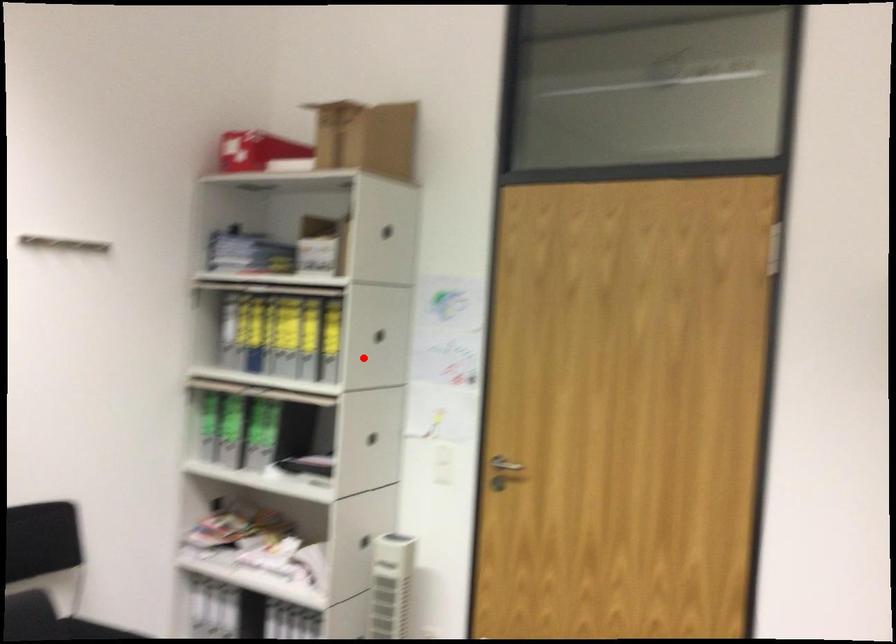
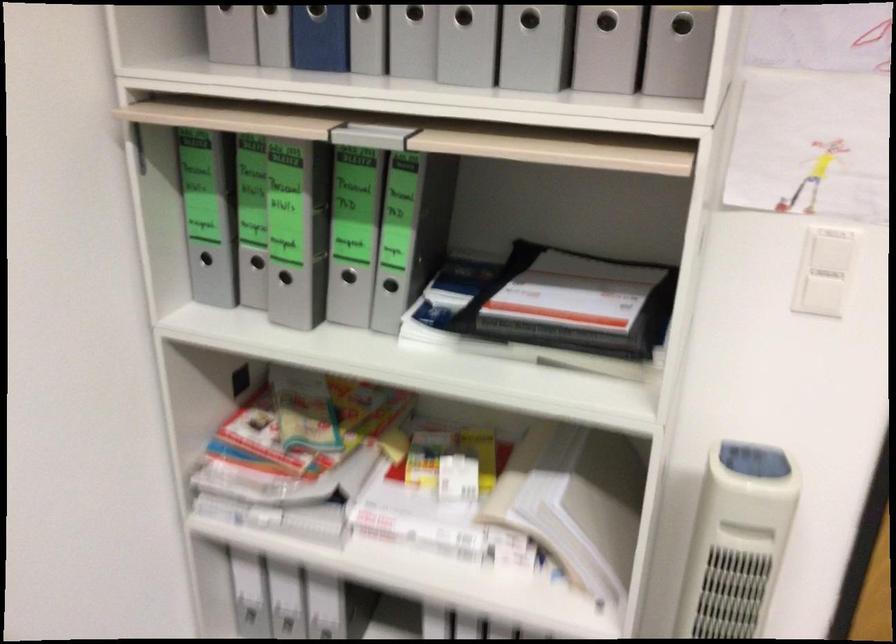
Question: I am providing you with two images of the same scene from different viewpoints. Image1 has a red point marked. In image2, the corresponding 3D location appears at what relative position? Reply with the corresponding letter.

Choices:
 (A) Closer
 (B) Farther

Answer: (A)